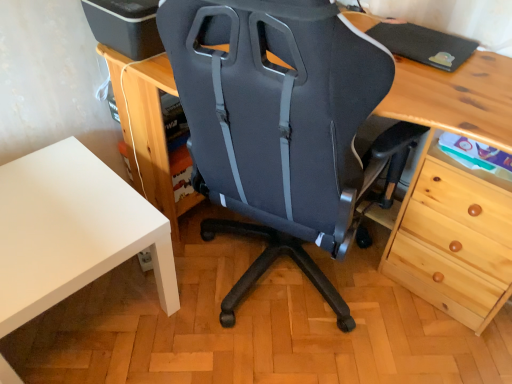
This screenshot has width=512, height=384. I want to click on white matte table at lower left, so [x=72, y=231].

This screenshot has height=384, width=512. Describe the element at coordinates (72, 231) in the screenshot. I see `white matte table at lower left` at that location.

Where is `matte black chair at center`? The height and width of the screenshot is (384, 512). matte black chair at center is located at coordinates (276, 124).

Image resolution: width=512 pixels, height=384 pixels. What do you see at coordinates (276, 124) in the screenshot?
I see `matte black chair at center` at bounding box center [276, 124].

Where is `white matte table at lower left`? The height and width of the screenshot is (384, 512). white matte table at lower left is located at coordinates (72, 231).

Considering the positions of objects matte black chair at center and white matte table at lower left in the image provided, who is more to the left, matte black chair at center or white matte table at lower left?

Positioned to the left is white matte table at lower left.

Which object is further away from the camera taking this photo, matte black chair at center or white matte table at lower left?

white matte table at lower left is more distant.

Which point is more forward, (308, 148) or (6, 230)?

Point (308, 148)

From the image's perspective, would you say matte black chair at center is shown under white matte table at lower left?

No, from the image's perspective, matte black chair at center is not below white matte table at lower left.

From a real-world perspective, who is located lower, matte black chair at center or white matte table at lower left?

white matte table at lower left.

Which of these two, matte black chair at center or white matte table at lower left, is wider?

With larger width is matte black chair at center.

Between matte black chair at center and white matte table at lower left, which one has less height?

white matte table at lower left.

Is matte black chair at center bigger than white matte table at lower left?

Indeed, matte black chair at center has a larger size compared to white matte table at lower left.

Is white matte table at lower left surrounded by matte black chair at center?

No, matte black chair at center does not contain white matte table at lower left.

Is there a large distance between matte black chair at center and white matte table at lower left?

matte black chair at center is near white matte table at lower left, not far away.

Is matte black chair at center facing towards white matte table at lower left?

No.

Can you tell me how much matte black chair at center and white matte table at lower left differ in facing direction?

107 degrees.

This screenshot has height=384, width=512. I want to click on chair above the white matte table at lower left (from a real-world perspective), so click(276, 124).

Considering the relative positions of white matte table at lower left and matte black chair at center in the image provided, is white matte table at lower left to the right of matte black chair at center from the viewer's perspective?

In fact, white matte table at lower left is to the left of matte black chair at center.

From the picture: Is the position of white matte table at lower left less distant than that of matte black chair at center?

No, white matte table at lower left is further to the viewer.

Is point (25, 184) positioned after point (347, 130)?

Yes.

From the image's perspective, does white matte table at lower left appear lower than matte black chair at center?

Yes, from the image's perspective, white matte table at lower left is beneath matte black chair at center.

From a real-world perspective, is white matte table at lower left located beneath matte black chair at center?

Yes.

Is white matte table at lower left thinner than matte black chair at center?

Yes.

Does white matte table at lower left have a lesser height compared to matte black chair at center?

Correct, white matte table at lower left is not as tall as matte black chair at center.

Considering the sizes of objects white matte table at lower left and matte black chair at center in the image provided, who is bigger, white matte table at lower left or matte black chair at center?

With larger size is matte black chair at center.

Is white matte table at lower left not within matte black chair at center?

Yes.

Is white matte table at lower left not close to matte black chair at center?

That's not correct — white matte table at lower left is a little close to matte black chair at center.

Is white matte table at lower left oriented towards matte black chair at center?

No, white matte table at lower left is not facing towards matte black chair at center.

How different are the orientations of white matte table at lower left and matte black chair at center in degrees?

107 degrees separate the facing orientations of white matte table at lower left and matte black chair at center.

Find the location of a particular element. table that is behind the matte black chair at center is located at coordinates (72, 231).

You are a GUI agent. You are given a task and a screenshot of the screen. Output one action in this format:
    pyautogui.click(x=<x>, y=<y>)
    Task: Click on the chair positioned vertically above the white matte table at lower left (from a real-world perspective)
    The height and width of the screenshot is (384, 512).
    Given the screenshot: What is the action you would take?
    pyautogui.click(x=276, y=124)

Find the location of a particular element. chair that is in front of the white matte table at lower left is located at coordinates (276, 124).